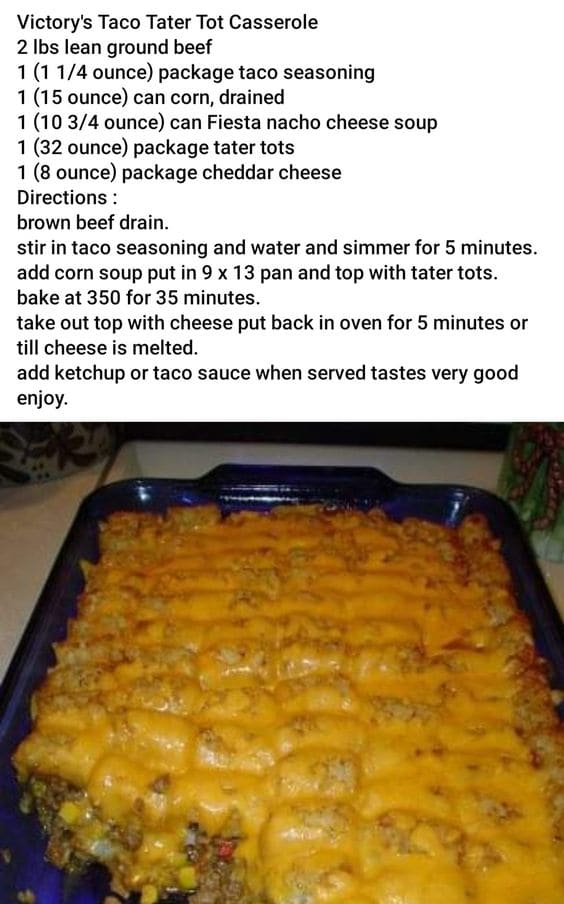
Identify the location of white counter / table top. Image resolution: width=564 pixels, height=904 pixels. (30, 531).